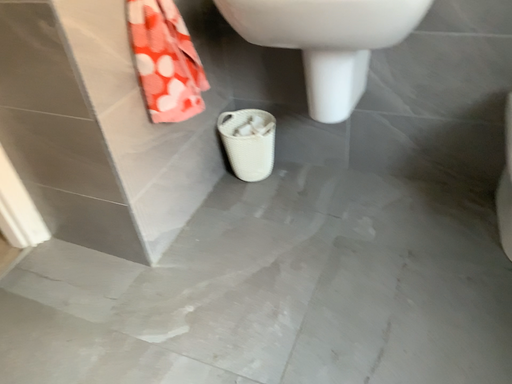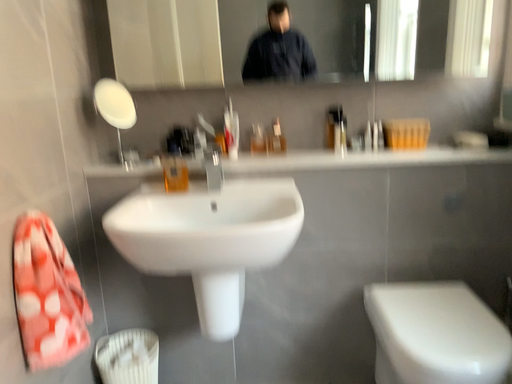
Question: Which way did the camera rotate in the video?

Choices:
 (A) rotated downward
 (B) rotated upward

Answer: (B)